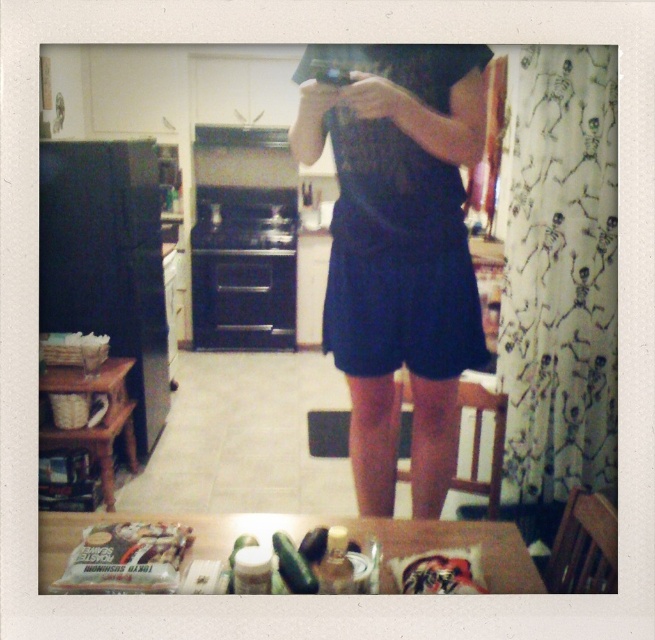
Does dark blue fabric dress at center have a lesser width compared to white matte bag of almond butter at lower left?

In fact, dark blue fabric dress at center might be wider than white matte bag of almond butter at lower left.

Which is in front, point (428, 364) or point (134, 531)?

Positioned in front is point (134, 531).

In order to click on dark blue fabric dress at center in this screenshot , I will do `click(398, 248)`.